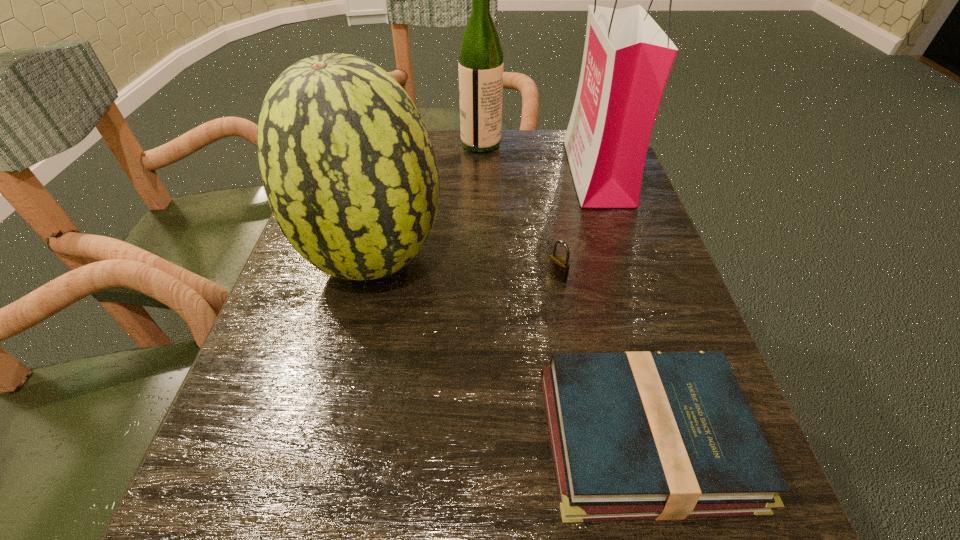
This screenshot has width=960, height=540. In order to click on vacant space located on the label of the fourth object from right to left in this screenshot , I will do `click(376, 144)`.

You are a GUI agent. You are given a task and a screenshot of the screen. Output one action in this format:
    pyautogui.click(x=<x>, y=<y>)
    Task: Click on the free space located 0.180m on the label of the fourth object from right to left
    The image size is (960, 540).
    Given the screenshot: What is the action you would take?
    pyautogui.click(x=392, y=144)

What are the coordinates of `free spot located on the front of the leftmost object` in the screenshot? It's located at (343, 386).

Identify the location of vacant space situated 0.250m on the back of the second shortest object. tap(542, 191).

Where is `vacant space located 0.350m on the left of the nearest object`? Image resolution: width=960 pixels, height=540 pixels. vacant space located 0.350m on the left of the nearest object is located at coordinates (290, 437).

The image size is (960, 540). In order to click on shopping bag located in the far edge section of the desktop in this screenshot , I will do `click(627, 59)`.

Where is `liquor at the far edge`? Image resolution: width=960 pixels, height=540 pixels. liquor at the far edge is located at coordinates (480, 66).

Locate an element on the screen. object located in the near edge section of the desktop is located at coordinates (642, 435).

Where is `object that is at the left edge`? The width and height of the screenshot is (960, 540). object that is at the left edge is located at coordinates (350, 173).

This screenshot has height=540, width=960. Find the location of `shopping bag located at the right edge`. shopping bag located at the right edge is located at coordinates (627, 59).